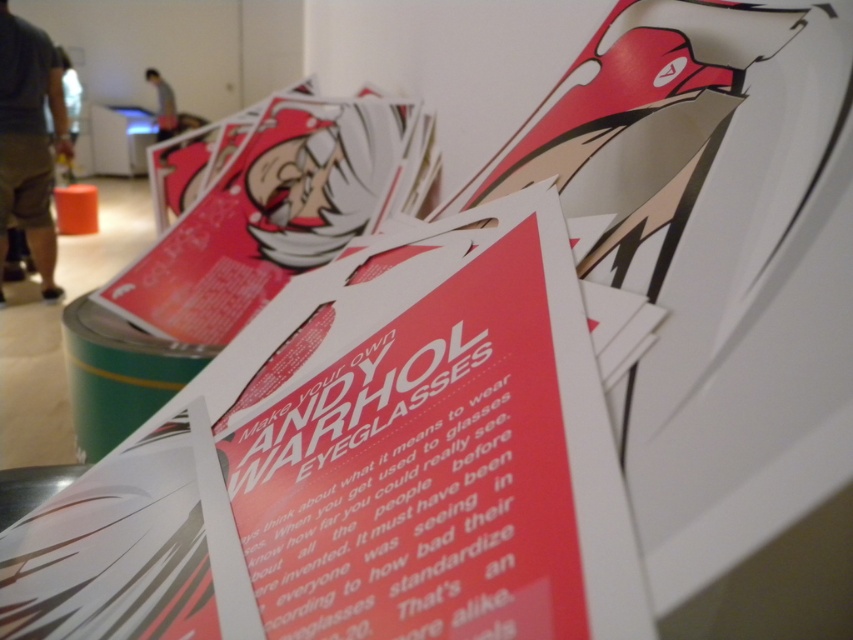
Which is below, dark gray cotton shorts at left or blurred gray shirt at upper left?

dark gray cotton shorts at left

Can you confirm if dark gray cotton shorts at left is smaller than blurred gray shirt at upper left?

No.

Is point (38, 243) closer to viewer compared to point (160, 97)?

Yes, it is.

This screenshot has width=853, height=640. I want to click on dark gray cotton shorts at left, so click(28, 140).

Is matte paper poster at center taller than dark gray cotton shorts at left?

In fact, matte paper poster at center may be shorter than dark gray cotton shorts at left.

From the picture: Which of these two, matte paper poster at center or dark gray cotton shorts at left, stands taller?

dark gray cotton shorts at left is taller.

Between point (596, 490) and point (45, 241), which one is positioned in front?

Point (596, 490) is more forward.

The width and height of the screenshot is (853, 640). Find the location of `matte paper poster at center`. matte paper poster at center is located at coordinates (363, 468).

Which is above, matte paper poster at center or blurred gray shirt at upper left?

blurred gray shirt at upper left is above.

Is matte paper poster at center wider than blurred gray shirt at upper left?

Yes.

Where is `matte paper poster at center`? matte paper poster at center is located at coordinates (363, 468).